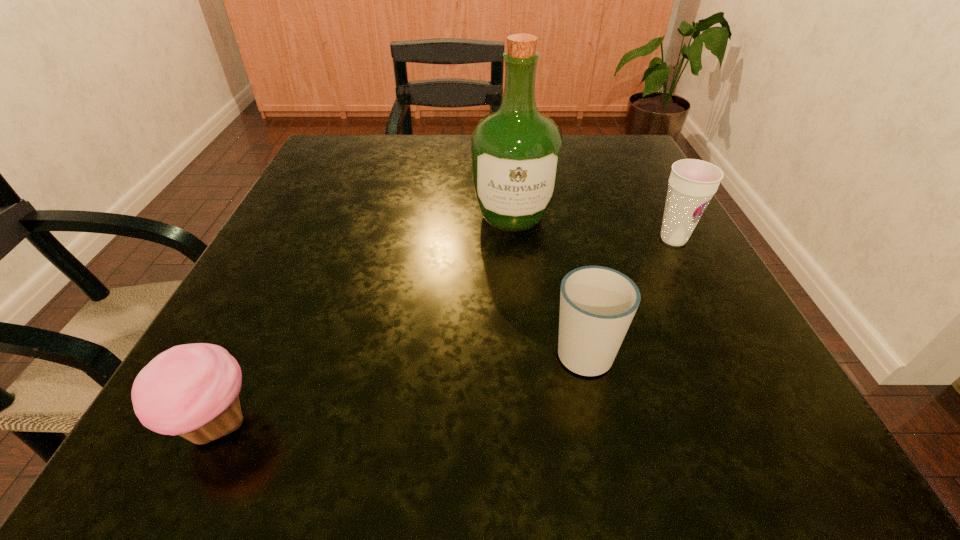
Locate an element on the screen. This screenshot has height=540, width=960. vacant space positioned with a handle on the side of the left cup is located at coordinates (549, 193).

Find the location of a particular element. The height and width of the screenshot is (540, 960). vacant area situated with a handle on the side of the left cup is located at coordinates (566, 271).

You are a GUI agent. You are given a task and a screenshot of the screen. Output one action in this format:
    pyautogui.click(x=<x>, y=<y>)
    Task: Click on the blank space located on the back of the leftmost object
    The height and width of the screenshot is (540, 960).
    Given the screenshot: What is the action you would take?
    pyautogui.click(x=321, y=209)

I want to click on object located at the near edge, so click(192, 390).

At what (x,y) coordinates should I click in order to perform the action: click on object located in the left edge section of the desktop. Please return your answer as a coordinate pair (x, y). Image resolution: width=960 pixels, height=540 pixels. Looking at the image, I should click on (192, 390).

This screenshot has height=540, width=960. Identify the location of object that is at the right edge. (692, 183).

The width and height of the screenshot is (960, 540). What are the coordinates of `object that is at the near left corner` in the screenshot? It's located at (192, 390).

Where is `free point at the far edge`? free point at the far edge is located at coordinates (431, 138).

Locate an element on the screen. free space at the near edge of the desktop is located at coordinates (491, 446).

In the image, there is a desktop. Identify the location of vacant area at the left edge. (295, 190).